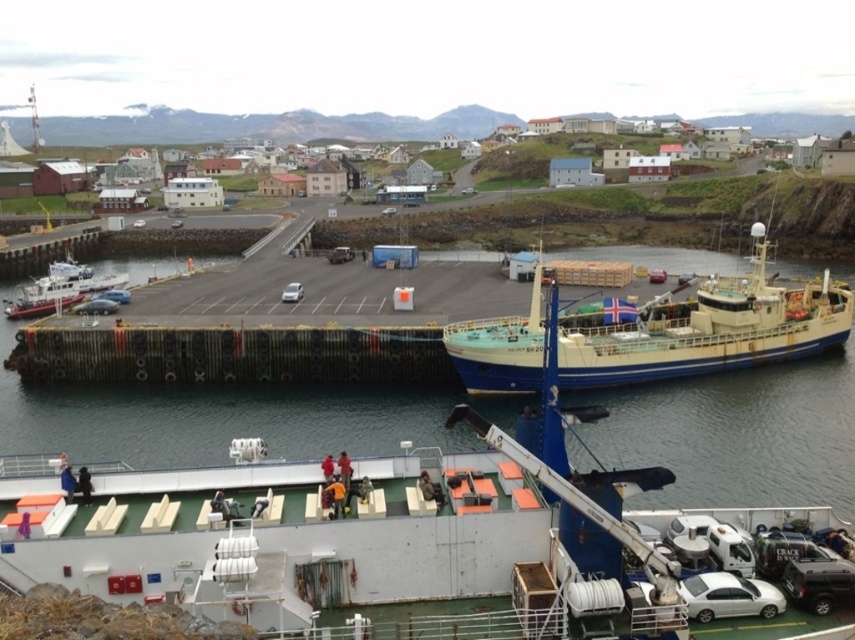
Does white plastic boat at left have a larger size compared to matte silver car at center?

Yes, white plastic boat at left is bigger than matte silver car at center.

Who is more forward, (38, 291) or (116, 305)?

Point (116, 305)

The image size is (855, 640). I want to click on white plastic boat at left, so click(60, 289).

Who is higher up, blue painted steel boat at center or white matte car at center?

blue painted steel boat at center

Between blue painted steel boat at center and white matte car at center, which one has less height?

Standing shorter between the two is white matte car at center.

The height and width of the screenshot is (640, 855). Describe the element at coordinates (702, 326) in the screenshot. I see `blue painted steel boat at center` at that location.

Identify the location of blue painted steel boat at center. (702, 326).

Can you confirm if white matte boat at center is positioned below blue painted steel boat at center?

Yes.

Is white matte boat at center positioned in front of blue painted steel boat at center?

Yes.

At what (x,y) coordinates should I click in order to perform the action: click on white matte boat at center. Please return your answer as a coordinate pair (x, y). The image size is (855, 640). Looking at the image, I should click on (357, 540).

The height and width of the screenshot is (640, 855). I want to click on white matte boat at center, so click(x=357, y=540).